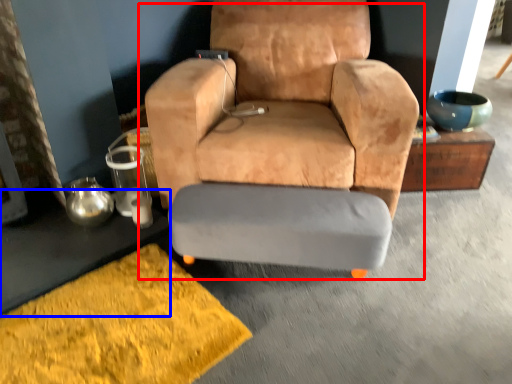
Question: Which of the following is the closest to the observer, chair (highlighted by a red box) or table (highlighted by a blue box)?

Choices:
 (A) chair
 (B) table

Answer: (A)